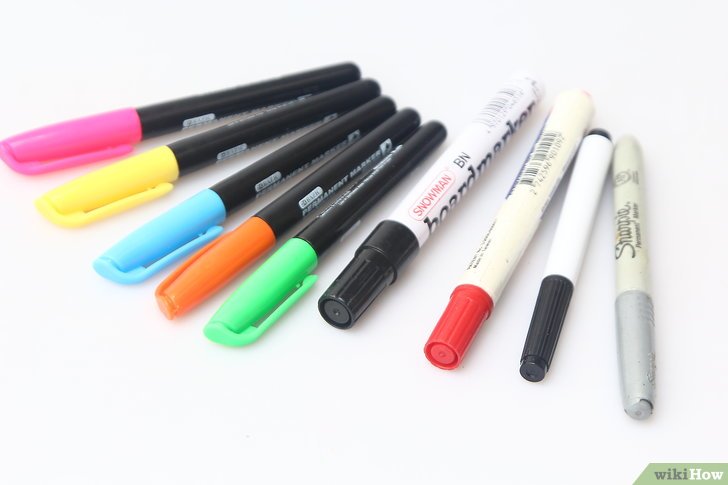
Identify the location of markers with colored top and black bottom. (339, 208), (304, 187), (276, 158), (253, 122), (245, 97).